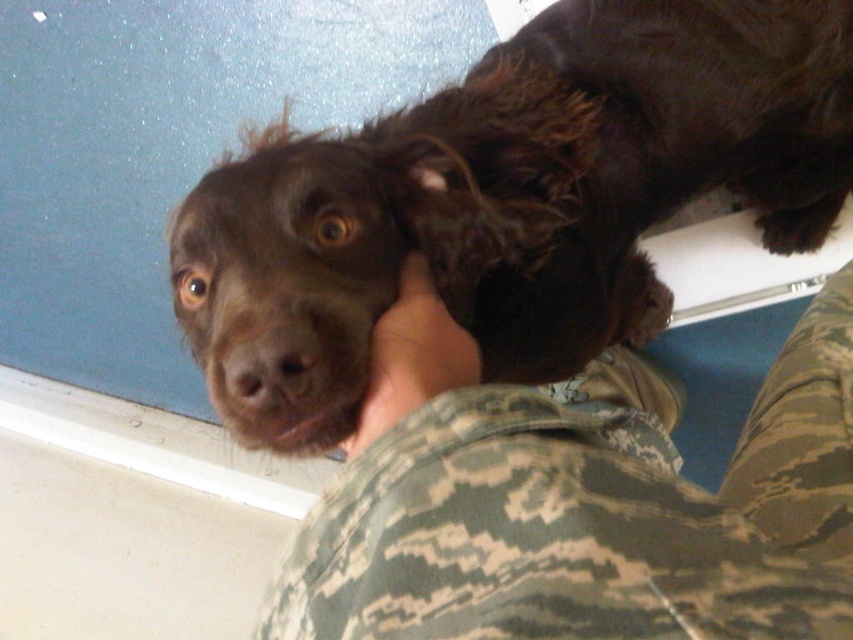
Which is below, brown furry dog at center or brown furry paw at center?

Positioned lower is brown furry paw at center.

In the scene shown: Between brown furry dog at center and brown furry paw at center, which one has less height?

brown furry paw at center is shorter.

Does point (589, 122) come behind point (439, 376)?

Yes, point (589, 122) is behind point (439, 376).

Locate an element on the screen. The width and height of the screenshot is (853, 640). brown furry dog at center is located at coordinates (508, 198).

Between camo fabric shirt at center and brown furry paw at center, which one is positioned lower?

Positioned lower is camo fabric shirt at center.

Is camo fabric shirt at center smaller than brown furry paw at center?

No.

Who is more distant from viewer, (773, 634) or (428, 291)?

Positioned behind is point (428, 291).

I want to click on camo fabric shirt at center, so click(x=575, y=508).

Can you confirm if brown furry dog at center is taller than camo fabric shirt at center?

Indeed, brown furry dog at center has a greater height compared to camo fabric shirt at center.

Can you confirm if brown furry dog at center is smaller than camo fabric shirt at center?

Incorrect, brown furry dog at center is not smaller in size than camo fabric shirt at center.

Which is behind, point (424, 125) or point (602, 566)?

Positioned behind is point (424, 125).

Identify the location of brown furry dog at center. (508, 198).